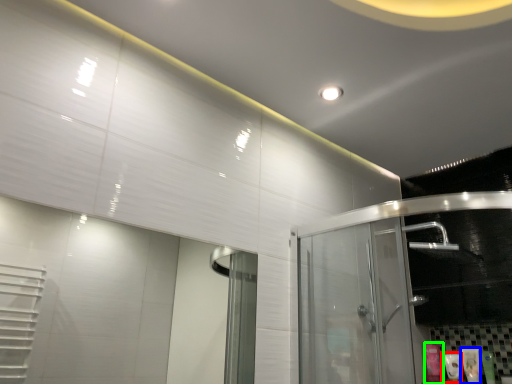
Question: Which is farther away from toiletry (highlighted by a red box)? toiletry (highlighted by a blue box) or toiletry (highlighted by a green box)?

Choices:
 (A) toiletry
 (B) toiletry

Answer: (A)